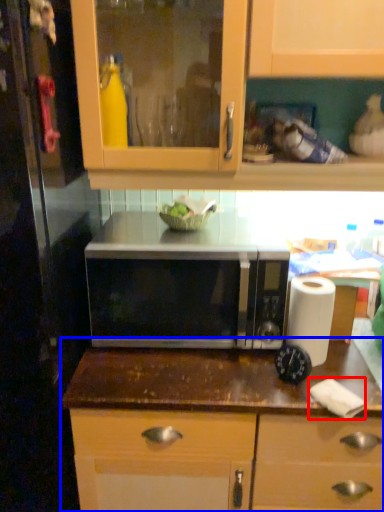
Question: Which object appears farthest to the camera in this image, toilet paper (highlighted by a red box) or countertop (highlighted by a blue box)?

Choices:
 (A) toilet paper
 (B) countertop

Answer: (B)